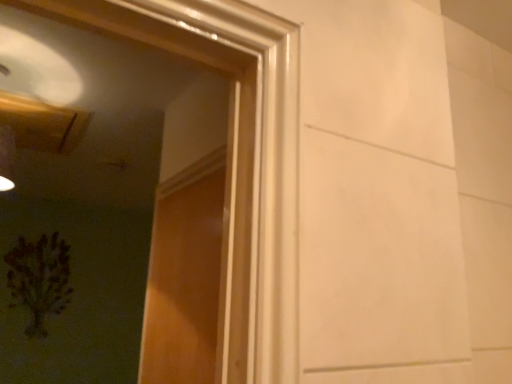
Question: Should I look upward or downward to see green matte plant at lower left?

Choices:
 (A) up
 (B) down

Answer: (B)